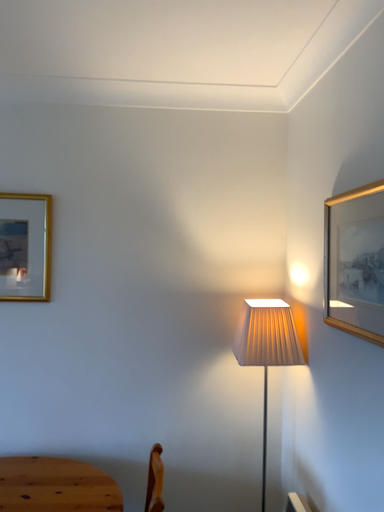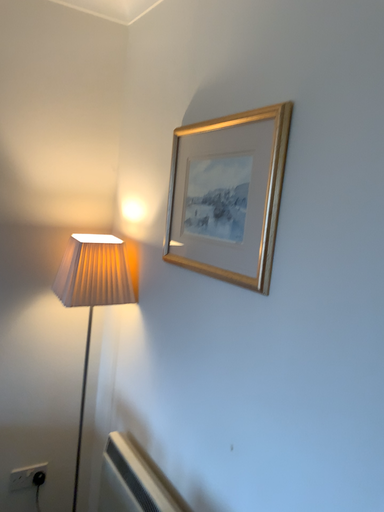
Question: Which way did the camera rotate in the video?

Choices:
 (A) rotated downward
 (B) rotated upward

Answer: (A)